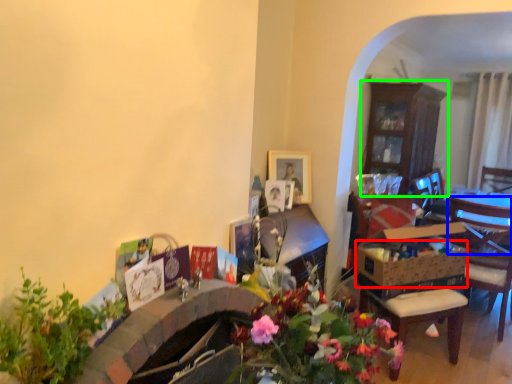
Question: Which object is the farthest from flower basket (highlighted by a red box)? Choose among these: chair (highlighted by a blue box) or cabinetry (highlighted by a green box).

Choices:
 (A) chair
 (B) cabinetry

Answer: (B)